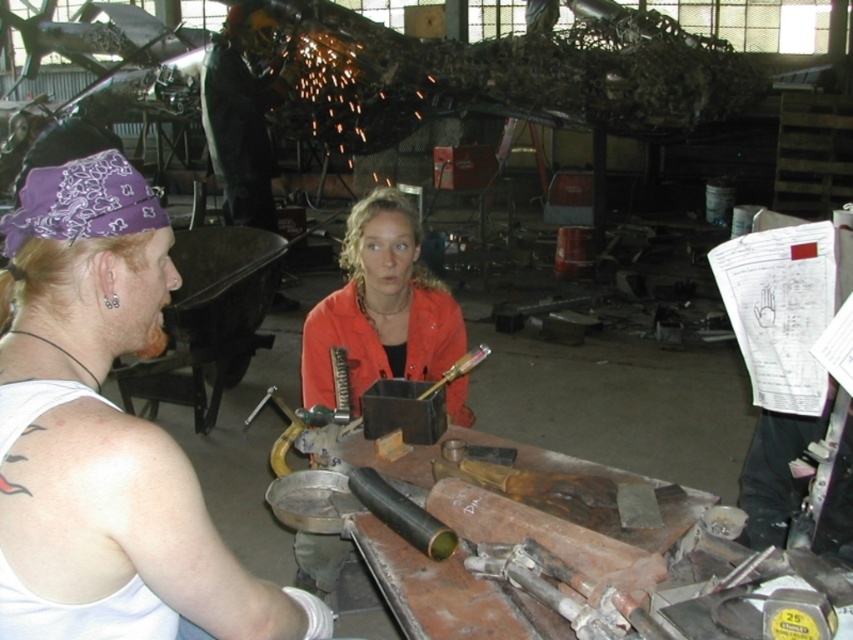
Question: Which object is farther from the camera taking this photo?

Choices:
 (A) shiny black helmet at upper center
 (B) orange matte jacket at center

Answer: (A)

Question: Can you confirm if purple bandana at left is positioned below orange matte jacket at center?

Choices:
 (A) yes
 (B) no

Answer: (A)

Question: Can you confirm if purple bandana at left is thinner than shiny black helmet at upper center?

Choices:
 (A) yes
 (B) no

Answer: (A)

Question: Which of these objects is positioned farthest from the purple bandana at left?

Choices:
 (A) orange matte jacket at center
 (B) shiny black helmet at upper center

Answer: (B)

Question: Is orange matte jacket at center above shiny black helmet at upper center?

Choices:
 (A) yes
 (B) no

Answer: (B)

Question: Which point is farther from the camera taking this photo?

Choices:
 (A) (90, 397)
 (B) (222, 212)
 (C) (425, 356)

Answer: (B)